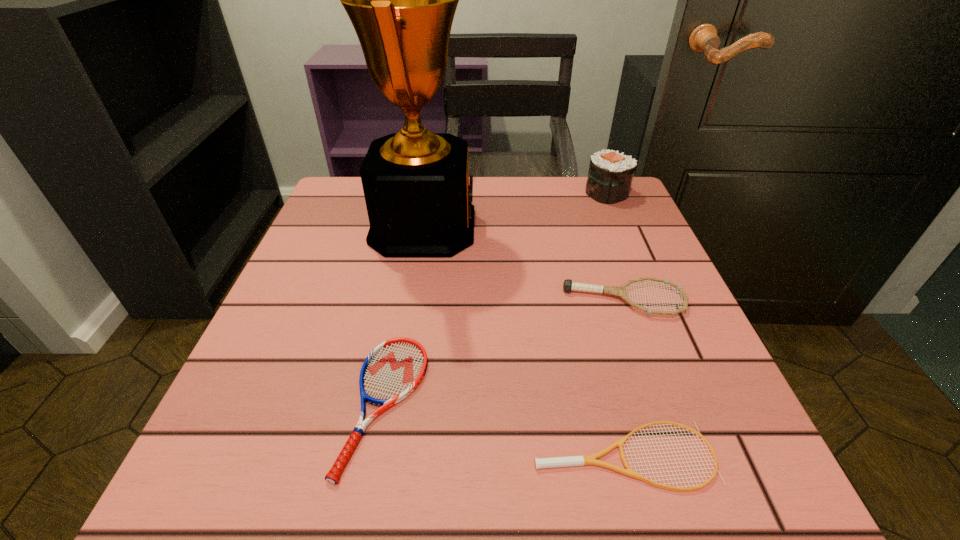
Identify the location of vacant space at the near left corner of the desktop. (278, 444).

Locate an element on the screen. Image resolution: width=960 pixels, height=540 pixels. vacant space at the far right corner of the desktop is located at coordinates (647, 231).

Image resolution: width=960 pixels, height=540 pixels. I want to click on vacant area that lies between the second tallest object and the leftmost tennis racket, so click(495, 299).

Locate an element on the screen. The image size is (960, 540). vacant space that's between the trophy cup and the sushi is located at coordinates (515, 210).

Identify the location of empty space between the second tallest object and the trophy cup. (515, 210).

This screenshot has width=960, height=540. In order to click on empty space between the tallest object and the fourth shortest object in this screenshot , I will do `click(515, 210)`.

Where is `unoccupied area between the trophy cup and the farthest tennis racket`? The height and width of the screenshot is (540, 960). unoccupied area between the trophy cup and the farthest tennis racket is located at coordinates (524, 264).

This screenshot has width=960, height=540. I want to click on empty space between the tallest tennis racket and the leftmost tennis racket, so click(505, 352).

I want to click on empty space that is in between the second tallest object and the leftmost tennis racket, so click(x=495, y=299).

What are the coordinates of `object that is the fourth closest to the third tallest object` in the screenshot? It's located at (610, 175).